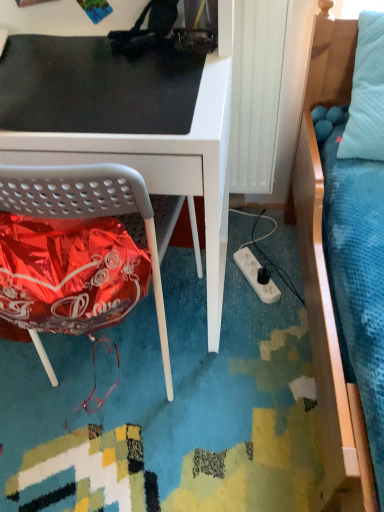
The height and width of the screenshot is (512, 384). Describe the element at coordinates (121, 122) in the screenshot. I see `white matte desk at center` at that location.

Find the location of a particular element. The image size is (384, 512). black matte mousepad at upper left is located at coordinates (97, 86).

What do you see at coordinates (256, 276) in the screenshot? I see `white plastic power outlet at lower center` at bounding box center [256, 276].

Image resolution: width=384 pixels, height=512 pixels. In order to click on white matte desk at center in this screenshot , I will do `click(121, 122)`.

Would you say white plastic power outlet at lower center is inside or outside white matte desk at center?

white plastic power outlet at lower center is not inside white matte desk at center, it's outside.

Consider the image. Does white plastic power outlet at lower center have a greater height compared to white matte desk at center?

Incorrect, the height of white plastic power outlet at lower center is not larger of that of white matte desk at center.

From the image's perspective, is white plastic power outlet at lower center positioned above or below white matte desk at center?

white plastic power outlet at lower center is situated lower than white matte desk at center in the image.

Looking at the image, does white matte desk at center seem bigger or smaller compared to black matte mousepad at upper left?

Considering their sizes, white matte desk at center takes up more space than black matte mousepad at upper left.

Is white matte desk at center facing away from black matte mousepad at upper left?

That's right, white matte desk at center is facing away from black matte mousepad at upper left.

Is white matte desk at center closer to the viewer compared to black matte mousepad at upper left?

Yes, it is in front of black matte mousepad at upper left.

From a real-world perspective, relative to black matte mousepad at upper left, is white matte desk at center vertically above or below?

white matte desk at center is situated lower than black matte mousepad at upper left in the real world.

Which is more to the right, black matte mousepad at upper left or white matte desk at center?

black matte mousepad at upper left.

Measure the distance between black matte mousepad at upper left and white matte desk at center.

black matte mousepad at upper left is 1.34 inches from white matte desk at center.

Between black matte mousepad at upper left and white matte desk at center, which one has larger width?

With larger width is white matte desk at center.

From the image's perspective, is black matte mousepad at upper left located above or below white matte desk at center?

Clearly, from the image's perspective, black matte mousepad at upper left is above white matte desk at center.

From a real-world perspective, is white matte desk at center under white plastic power outlet at lower center?

Incorrect, from a real-world perspective, white matte desk at center is higher than white plastic power outlet at lower center.

Is white matte desk at center aimed at white plastic power outlet at lower center?

No, white matte desk at center is not facing towards white plastic power outlet at lower center.

Where is `desk in front of the white plastic power outlet at lower center`? desk in front of the white plastic power outlet at lower center is located at coordinates (121, 122).

Considering the sizes of white matte desk at center and white plastic power outlet at lower center in the image, is white matte desk at center bigger or smaller than white plastic power outlet at lower center?

white matte desk at center is bigger than white plastic power outlet at lower center.

From the image's perspective, does black matte mousepad at upper left appear lower than white plastic power outlet at lower center?

No.

Could you measure the distance between black matte mousepad at upper left and white plastic power outlet at lower center?

They are 31.49 inches apart.

Is black matte mousepad at upper left positioned with its back to white plastic power outlet at lower center?

No, black matte mousepad at upper left is not facing the opposite direction of white plastic power outlet at lower center.

Are black matte mousepad at upper left and white plastic power outlet at lower center making contact?

black matte mousepad at upper left is not next to white plastic power outlet at lower center, and they're not touching.

Is black matte mousepad at upper left a part of white plastic power outlet at lower center?

No.

From a real-world perspective, is white plastic power outlet at lower center on black matte mousepad at upper left?

No, from a real-world perspective, white plastic power outlet at lower center is not above black matte mousepad at upper left.

From the image's perspective, is white plastic power outlet at lower center located above or below black matte mousepad at upper left?

Answer: Clearly, from the image's perspective, white plastic power outlet at lower center is below black matte mousepad at upper left.

What are the coordinates of `desk above the white plastic power outlet at lower center (from the image's perspective)` in the screenshot? It's located at (121, 122).

You are a GUI agent. You are given a task and a screenshot of the screen. Output one action in this format:
    pyautogui.click(x=<x>, y=<y>)
    Task: Click on the desk below the black matte mousepad at upper left (from the image's perspective)
    The image size is (384, 512).
    Given the screenshot: What is the action you would take?
    pyautogui.click(x=121, y=122)

When comparing their distances from black matte mousepad at upper left, does white matte desk at center or white plastic power outlet at lower center seem further?

white plastic power outlet at lower center is further to black matte mousepad at upper left.

Based on their spatial positions, is white matte desk at center or black matte mousepad at upper left further from white plastic power outlet at lower center?

Based on the image, black matte mousepad at upper left appears to be further to white plastic power outlet at lower center.

Which object lies further to the anchor point white matte desk at center, white plastic power outlet at lower center or black matte mousepad at upper left?

white plastic power outlet at lower center lies further to white matte desk at center than the other object.

Which object lies nearer to the anchor point white matte desk at center, black matte mousepad at upper left or white plastic power outlet at lower center?

black matte mousepad at upper left is positioned closer to the anchor white matte desk at center.

Considering their positions, is white plastic power outlet at lower center positioned further to black matte mousepad at upper left than white matte desk at center?

white plastic power outlet at lower center lies further to black matte mousepad at upper left than the other object.

In the scene shown: Looking at the image, which one is located closer to white plastic power outlet at lower center, black matte mousepad at upper left or white matte desk at center?

Among the two, white matte desk at center is located nearer to white plastic power outlet at lower center.

What are the coordinates of `table top between white matte desk at center and white plastic power outlet at lower center along the z-axis` in the screenshot? It's located at (97, 86).